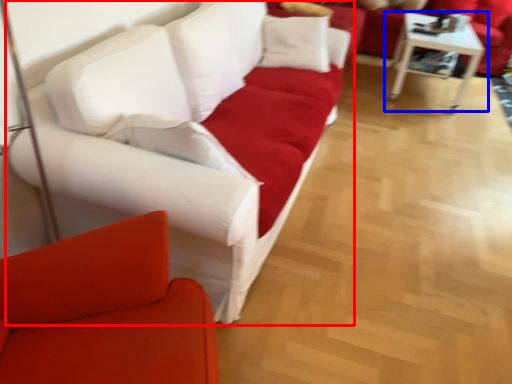
Question: Which point is further to the camera, studio couch (highlighted by a red box) or table (highlighted by a blue box)?

Choices:
 (A) studio couch
 (B) table

Answer: (B)